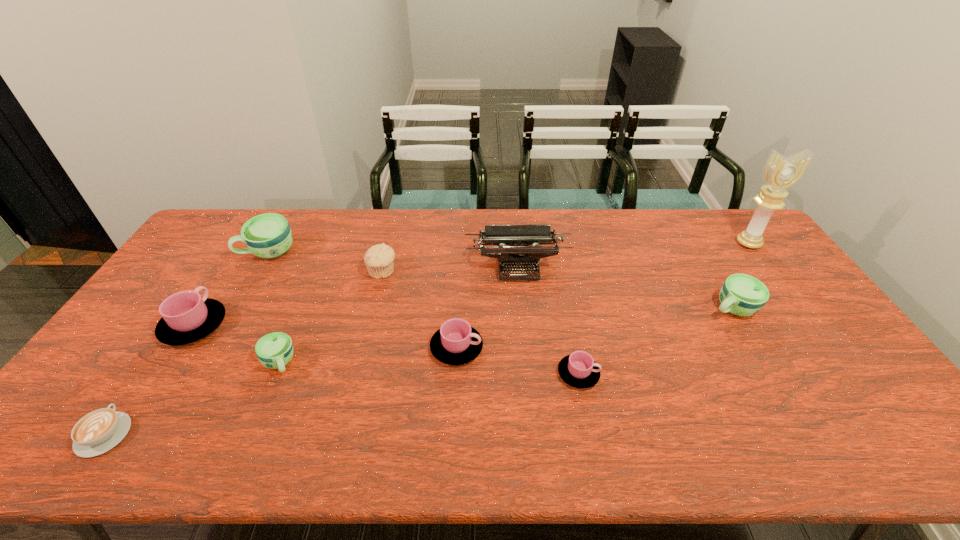
The image size is (960, 540). I want to click on the second pink cup from left to right, so click(x=456, y=343).

The width and height of the screenshot is (960, 540). What are the coordinates of `the second smallest pink cup` in the screenshot? It's located at (456, 343).

Where is `the fourth object from left to right`? the fourth object from left to right is located at coordinates (275, 350).

The height and width of the screenshot is (540, 960). I want to click on the second blue cup from right to left, so click(x=275, y=350).

At what (x,y) coordinates should I click in order to perform the action: click on the shortest cup. Please return your answer as a coordinate pair (x, y). This screenshot has height=540, width=960. Looking at the image, I should click on (579, 370).

Identify the location of the second cup from right to left. (579, 370).

Find the location of a particular element. the nearest object is located at coordinates (97, 432).

The image size is (960, 540). In order to click on cappuccino in this screenshot , I will do `click(97, 432)`.

At what (x,y) coordinates should I click in order to perform the action: click on vacant space located on the front-facing side of the rightmost object. Please return your answer as a coordinate pair (x, y). The width and height of the screenshot is (960, 540). Looking at the image, I should click on (779, 285).

Find the location of a particular element. blank space located 0.210m on the typing side of the typewriter is located at coordinates (524, 333).